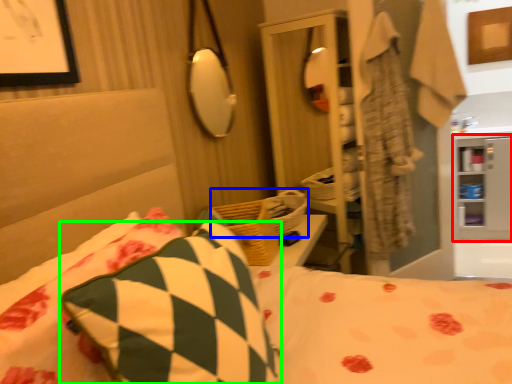
Question: Considering the real-world distances, which object is closest to cabinet (highlighted by a red box)? basket (highlighted by a blue box) or pillow (highlighted by a green box).

Choices:
 (A) basket
 (B) pillow

Answer: (A)